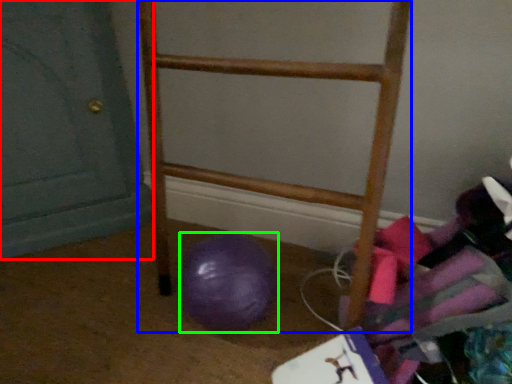
Question: Estimate the real-world distances between objects in this image. Which object is farther from door (highlighted by a red box), furniture (highlighted by a blue box) or ball (highlighted by a green box)?

Choices:
 (A) furniture
 (B) ball

Answer: (B)